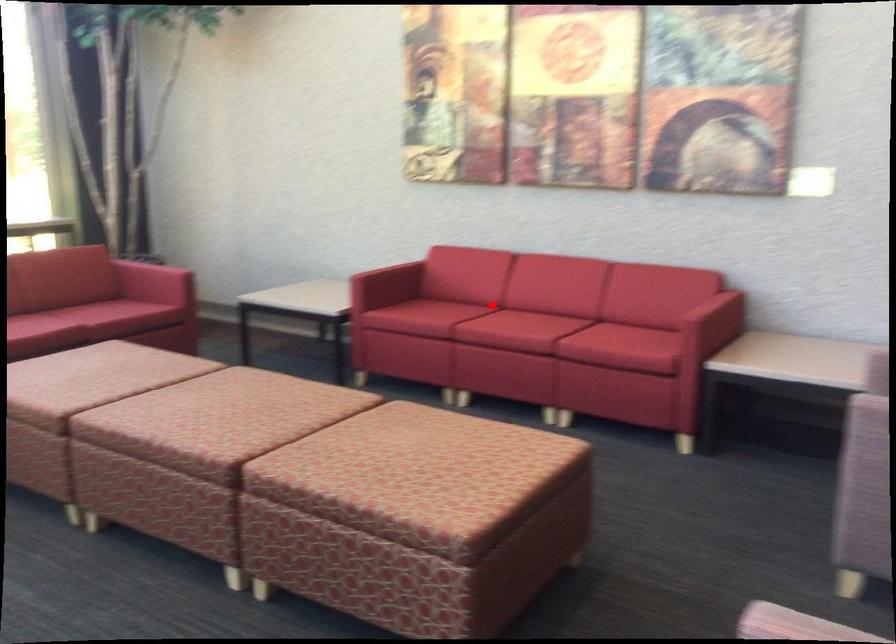
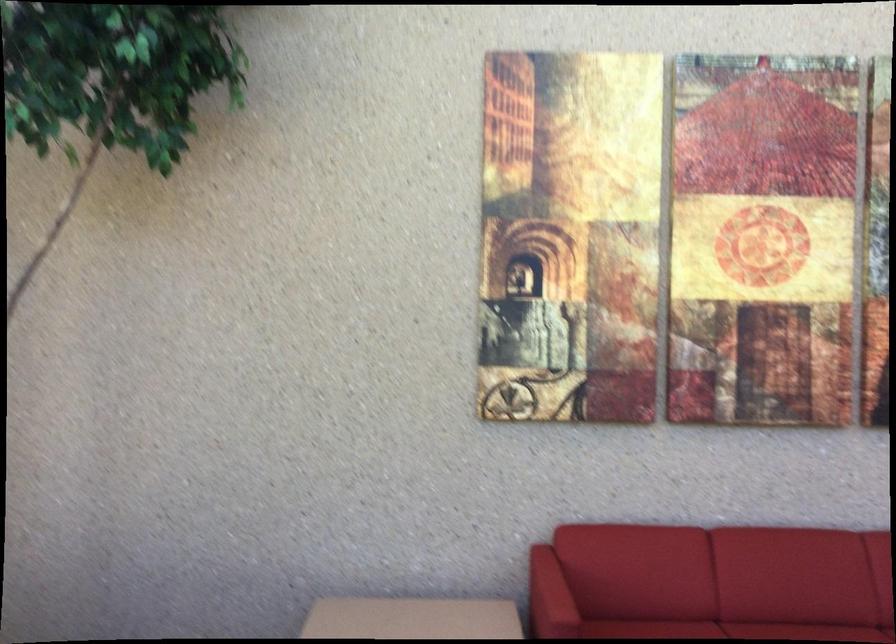
The point at the highlighted location is marked in the first image. Where is the corresponding point in the second image?

(727, 630)